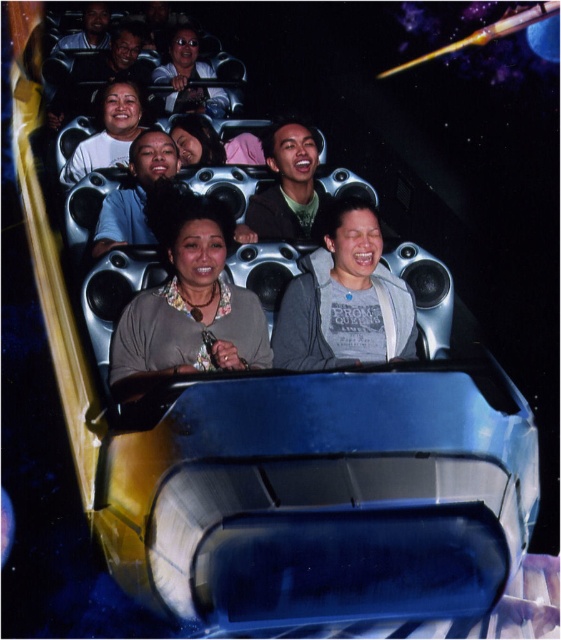
You are a photographer taking a picture of the riders on the roller coaster. You want to ensure both the matte gray sweater at center and the matte black jacket at upper center are clearly visible in the frame. Based on their positions, which object should you focus on first to capture both in the same shot?

The matte gray sweater at center is to the right of the matte black jacket at upper center, so focusing on the matte black jacket at upper center first will allow you to adjust the frame to include both objects since they are positioned side by side horizontally.

You are a photographer standing at the front of the roller coaster vehicle. You want to take a photo of the matte gray sweater at center and the matte black jacket at upper center so that both are clearly visible in the frame. Given their distance apart, is it possible to capture both in a single shot without moving the camera?

The matte gray sweater at center and the matte black jacket at upper center are 17.07 feet apart. Depending on the camera lens and focal length, it might be challenging to capture both in a single shot without moving the camera, as 17 feet is a relatively large distance for a close shot. A wider angle lens would be necessary to include both subjects in the frame.